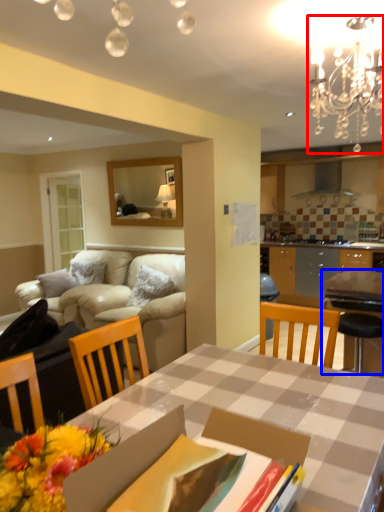
Question: Which point is further to the camera, light fixture (highlighted by a red box) or table (highlighted by a blue box)?

Choices:
 (A) light fixture
 (B) table

Answer: (B)